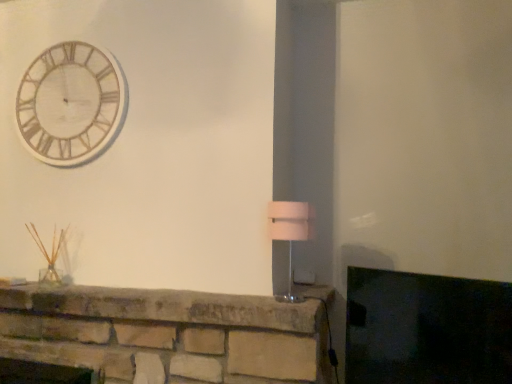
The width and height of the screenshot is (512, 384). What do you see at coordinates (290, 232) in the screenshot?
I see `white fabric lampshade at right` at bounding box center [290, 232].

In order to face wooden/textured clock at upper left, should I rotate leftwards or rightwards?

You should look left and rotate roughly 24.040 degrees.

Locate an element on the screen. white fabric lampshade at right is located at coordinates (290, 232).

Would you say white fabric lampshade at right is inside or outside matte stone fireplace at lower left?

white fabric lampshade at right exists outside the volume of matte stone fireplace at lower left.

Based on the photo, from the image's perspective, is white fabric lampshade at right above or below matte stone fireplace at lower left?

Based on their image positions, white fabric lampshade at right is located above matte stone fireplace at lower left.

Does white fabric lampshade at right lie in front of matte stone fireplace at lower left?

That is False.

Is white fabric lampshade at right wider than matte stone fireplace at lower left?

Yes.

Considering the sizes of objects wooden/textured clock at upper left and matte stone fireplace at lower left in the image provided, who is bigger, wooden/textured clock at upper left or matte stone fireplace at lower left?

matte stone fireplace at lower left is bigger.

Is wooden/textured clock at upper left with matte stone fireplace at lower left?

wooden/textured clock at upper left and matte stone fireplace at lower left are not in contact.

Is matte stone fireplace at lower left at the back of wooden/textured clock at upper left?

That's not correct — wooden/textured clock at upper left is not looking away from matte stone fireplace at lower left.

Looking at this image, from a real-world perspective, between wooden/textured clock at upper left and matte stone fireplace at lower left, who is vertically lower?

matte stone fireplace at lower left is physically lower.

In the scene shown: From a real-world perspective, who is located lower, matte stone fireplace at lower left or white fabric lampshade at right?

matte stone fireplace at lower left.

Considering the sizes of objects matte stone fireplace at lower left and white fabric lampshade at right in the image provided, who is thinner, matte stone fireplace at lower left or white fabric lampshade at right?

With smaller width is matte stone fireplace at lower left.

Which is nearer, (475,372) or (287,239)?

The point (475,372) is closer.

From the image's perspective, who appears lower, matte stone fireplace at lower left or white fabric lampshade at right?

matte stone fireplace at lower left appears lower in the image.

You are a GUI agent. You are given a task and a screenshot of the screen. Output one action in this format:
    pyautogui.click(x=<x>, y=<y>)
    Task: Click on the table lamp located below the wooden/textured clock at upper left (from the image's perspective)
    The image size is (512, 384).
    Given the screenshot: What is the action you would take?
    pyautogui.click(x=290, y=232)

Is wooden/textured clock at upper left looking in the opposite direction of white fabric lampshade at right?

wooden/textured clock at upper left does not have its back to white fabric lampshade at right.

From a real-world perspective, is wooden/textured clock at upper left positioned under white fabric lampshade at right based on gravity?

No, from a real-world perspective, wooden/textured clock at upper left is not below white fabric lampshade at right.

From the image's perspective, is wooden/textured clock at upper left under white fabric lampshade at right?

Actually, wooden/textured clock at upper left appears above white fabric lampshade at right in the image.

From a real-world perspective, is matte stone fireplace at lower left above or below wooden/textured clock at upper left?

matte stone fireplace at lower left is situated lower than wooden/textured clock at upper left in the real world.

Is matte stone fireplace at lower left behind wooden/textured clock at upper left?

No, matte stone fireplace at lower left is closer to the viewer.

Locate an element on the screen. fireplace that appears on the right of wooden/textured clock at upper left is located at coordinates (426, 329).

Would you say white fabric lampshade at right is inside or outside wooden/textured clock at upper left?

white fabric lampshade at right is outside wooden/textured clock at upper left.

Is point (295, 236) closer or farther from the camera than point (103, 81)?

Point (295, 236) is positioned closer to the camera compared to point (103, 81).

Measure the distance between white fabric lampshade at right and wooden/textured clock at upper left.

They are 1.06 meters apart.

From a real-world perspective, relative to wooden/textured clock at upper left, is white fabric lampshade at right vertically above or below?

Clearly, from a real-world perspective, white fabric lampshade at right is below wooden/textured clock at upper left.

Where is `table lamp that appears on the left of matte stone fireplace at lower left`? This screenshot has height=384, width=512. table lamp that appears on the left of matte stone fireplace at lower left is located at coordinates (290, 232).

The image size is (512, 384). Find the location of `fireplace that appears in front of the wooden/textured clock at upper left`. fireplace that appears in front of the wooden/textured clock at upper left is located at coordinates (426, 329).

Looking at the image, which one is located further to matte stone fireplace at lower left, wooden/textured clock at upper left or white fabric lampshade at right?

wooden/textured clock at upper left is further to matte stone fireplace at lower left.

Which object lies further to the anchor point white fabric lampshade at right, matte stone fireplace at lower left or wooden/textured clock at upper left?

wooden/textured clock at upper left is positioned further to the anchor white fabric lampshade at right.

Considering their positions, is wooden/textured clock at upper left positioned closer to white fabric lampshade at right than matte stone fireplace at lower left?

matte stone fireplace at lower left lies closer to white fabric lampshade at right than the other object.

From the image, which object appears to be nearer to wooden/textured clock at upper left, white fabric lampshade at right or matte stone fireplace at lower left?

Based on the image, white fabric lampshade at right appears to be nearer to wooden/textured clock at upper left.

Looking at the image, which one is located closer to matte stone fireplace at lower left, white fabric lampshade at right or wooden/textured clock at upper left?

Among the two, white fabric lampshade at right is located nearer to matte stone fireplace at lower left.

Looking at the image, which one is located further to wooden/textured clock at upper left, matte stone fireplace at lower left or white fabric lampshade at right?

matte stone fireplace at lower left.

Where is `table lamp located between wooden/textured clock at upper left and matte stone fireplace at lower left in the left-right direction`? The width and height of the screenshot is (512, 384). table lamp located between wooden/textured clock at upper left and matte stone fireplace at lower left in the left-right direction is located at coordinates (290, 232).